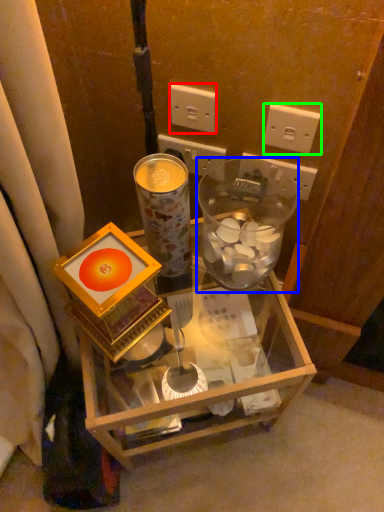
Question: Which object is positioned closest to power outlet (highlighted by a red box)? Select from glass jar (highlighted by a blue box) and power outlet (highlighted by a green box).

Choices:
 (A) glass jar
 (B) power outlet

Answer: (B)